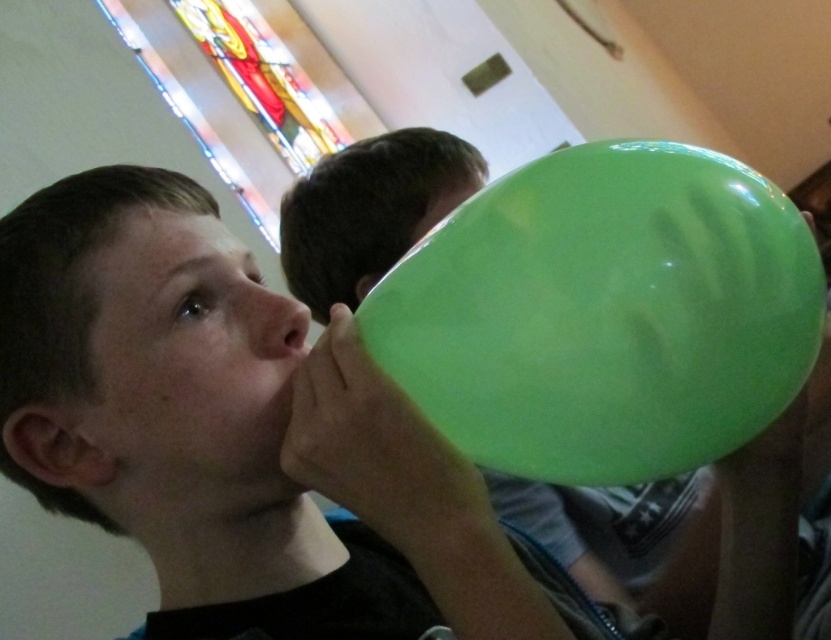
Question: Which object is the closest to the green rubber balloon at center?

Choices:
 (A) matte green balloon at upper right
 (B) smooth skin face at center

Answer: (A)

Question: Is matte green balloon at upper right closer to the viewer compared to smooth skin face at center?

Choices:
 (A) yes
 (B) no

Answer: (A)

Question: Which point appears farthest from the camera in this image?

Choices:
 (A) (112, 390)
 (B) (553, 241)
 (C) (219, 472)

Answer: (C)

Question: Is matte green balloon at upper right in front of smooth skin face at center?

Choices:
 (A) no
 (B) yes

Answer: (B)

Question: Is green rubber balloon at center wider than smooth skin face at center?

Choices:
 (A) yes
 (B) no

Answer: (A)

Question: Which of the following is the closest to the observer?

Choices:
 (A) (241, 506)
 (B) (613, 333)

Answer: (B)